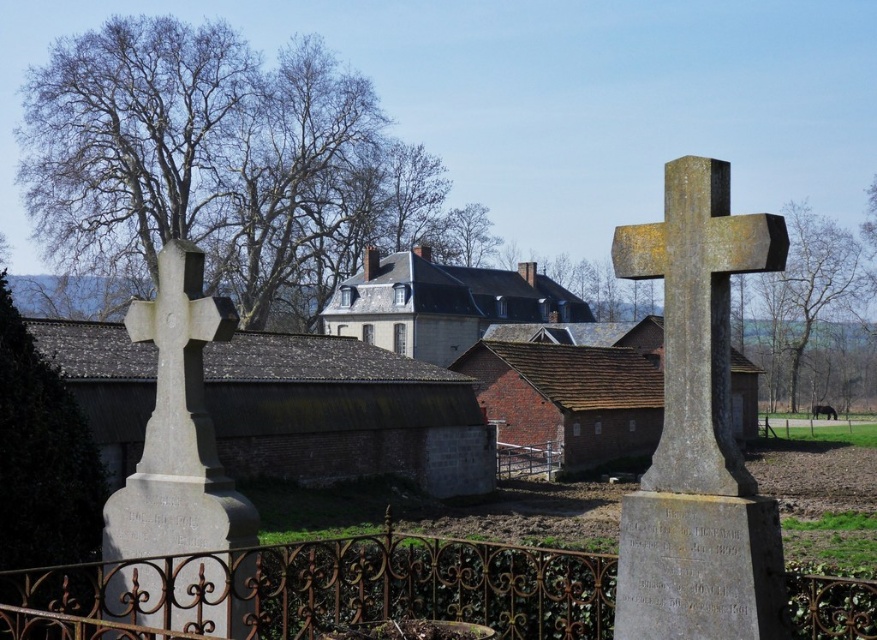
Question: Which of the following is the farthest from the observer?

Choices:
 (A) bare wood tree at upper right
 (B) iron ornate fence at lower center
 (C) gray stone cross at right

Answer: (A)

Question: Observing the image, what is the correct spatial positioning of gray stone cross at right in reference to bare wood tree at upper right?

Choices:
 (A) right
 (B) left

Answer: (B)

Question: Does iron ornate fence at lower center have a lesser width compared to gray stone cross at right?

Choices:
 (A) yes
 (B) no

Answer: (A)

Question: Estimate the real-world distances between objects in this image. Which object is closer to the gray stone cross at right?

Choices:
 (A) iron ornate fence at lower center
 (B) brown textured tree at upper center

Answer: (A)

Question: Is bare wood tree at upper right positioned at the back of brown textured tree at upper center?

Choices:
 (A) yes
 (B) no

Answer: (B)

Question: Which of the following is the farthest from the observer?

Choices:
 (A) (726, 328)
 (B) (845, 298)

Answer: (B)